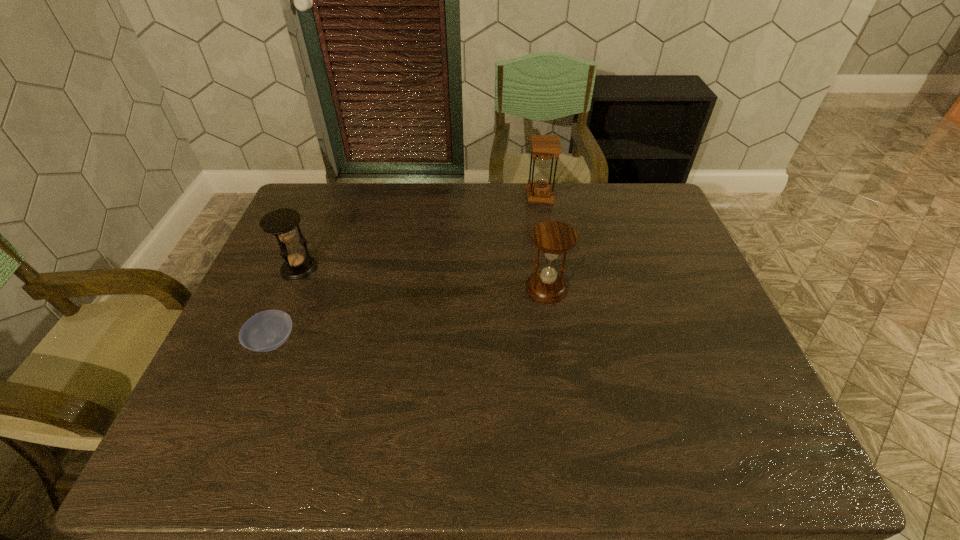
Where is `hourglass that is the second nearest to the farthest hourglass`? This screenshot has width=960, height=540. hourglass that is the second nearest to the farthest hourglass is located at coordinates (281, 222).